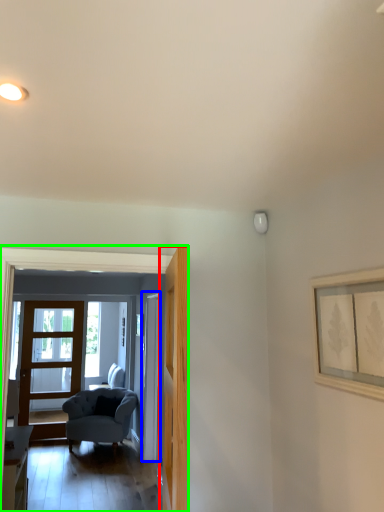
Question: Based on their relative distances, which object is nearer to door (highlighted by a red box)? Choose from door (highlighted by a blue box) and residence (highlighted by a green box).

Choices:
 (A) door
 (B) residence

Answer: (B)